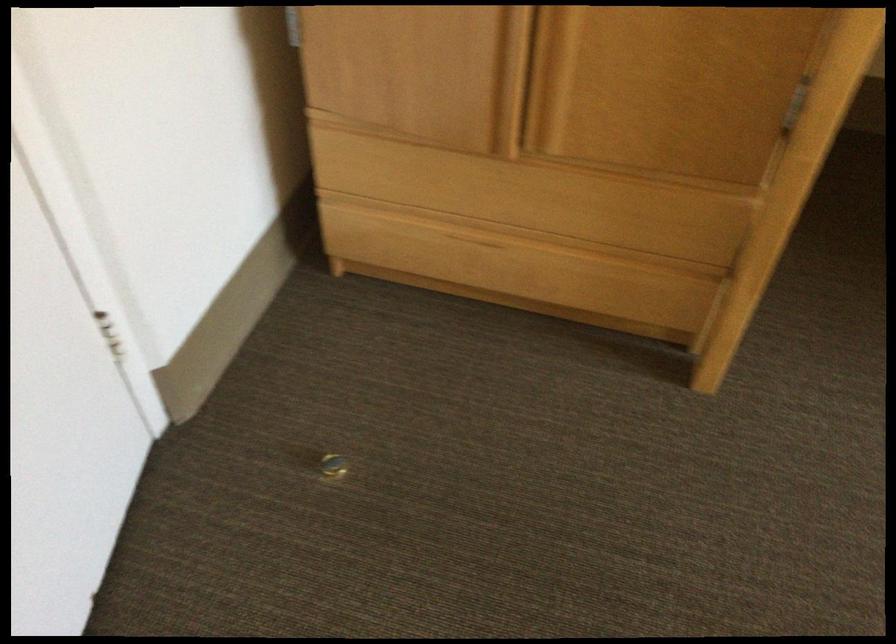
I want to click on cabinet door handle, so tap(533, 79).